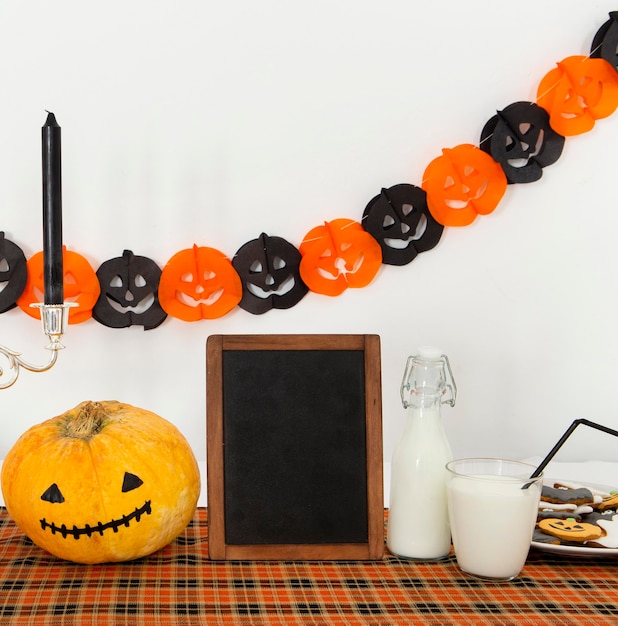
In order to click on glass of milk in this screenshot , I will do `click(487, 541)`.